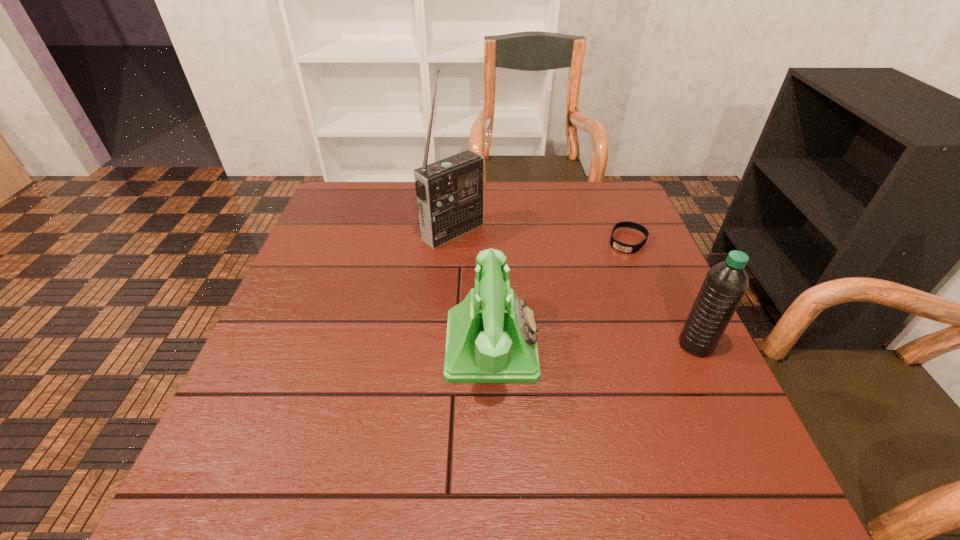
Image resolution: width=960 pixels, height=540 pixels. What are the coordinates of `free space at the near right corner of the desktop` in the screenshot? It's located at (706, 420).

Where is `free space between the water bottle and the second shortest object`? free space between the water bottle and the second shortest object is located at coordinates (594, 345).

Identify the location of vacant space in between the wristband and the telephone. (560, 293).

What are the coordinates of `free space between the shortest object and the third tallest object` in the screenshot? It's located at (560, 293).

Identify the location of free space that is in between the wristband and the radio receiver. Image resolution: width=960 pixels, height=540 pixels. (540, 236).

Locate an element on the screen. Image resolution: width=960 pixels, height=540 pixels. free space between the radio receiver and the water bottle is located at coordinates (574, 288).

Find the location of a particular element. The width and height of the screenshot is (960, 540). free spot between the second shortest object and the wristband is located at coordinates (560, 293).

Where is `empty space between the shortest object and the second tallest object`? This screenshot has width=960, height=540. empty space between the shortest object and the second tallest object is located at coordinates (662, 293).

The width and height of the screenshot is (960, 540). What are the coordinates of `object that can be found as the closest to the tallest object` in the screenshot? It's located at (491, 337).

Locate which object ranks third in proximity to the radio receiver. Please provide its 2D coordinates. Your answer should be formatted as a tuple, i.e. [(x, y)], where the tuple contains the x and y coordinates of a point satisfying the conditions above.

[(725, 284)]